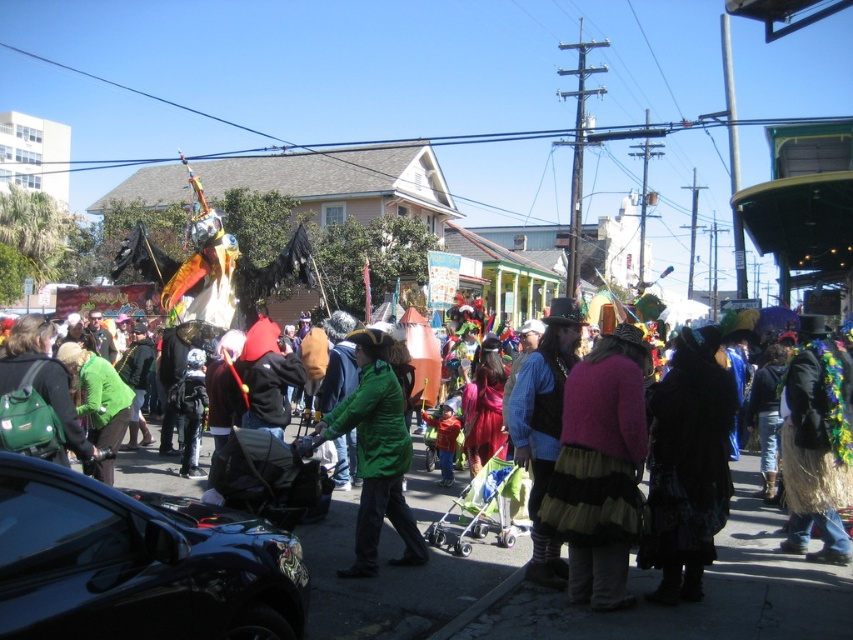
Question: Considering the real-world distances, which object is closest to the shiny metallic balloon at center?

Choices:
 (A) raffia skirt at center
 (B) green fabric backpack at lower left
 (C) black textured dress at center

Answer: (C)

Question: Can you confirm if pink tulle skirt at center is thinner than green fabric backpack at lower left?

Choices:
 (A) no
 (B) yes

Answer: (A)

Question: Is green matte jacket at center below green fabric backpack at lower left?

Choices:
 (A) yes
 (B) no

Answer: (A)

Question: Which object appears farthest from the camera in this image?

Choices:
 (A) pink tulle skirt at center
 (B) blue denim shirt at center
 (C) green matte jacket at center
 (D) raffia skirt at center

Answer: (D)

Question: Is shiny metallic balloon at center closer to the viewer compared to blue denim shirt at center?

Choices:
 (A) no
 (B) yes

Answer: (A)

Question: Which object is positioned closest to the shiny metallic balloon at center?

Choices:
 (A) green fabric backpack at lower left
 (B) green matte jacket at center

Answer: (B)